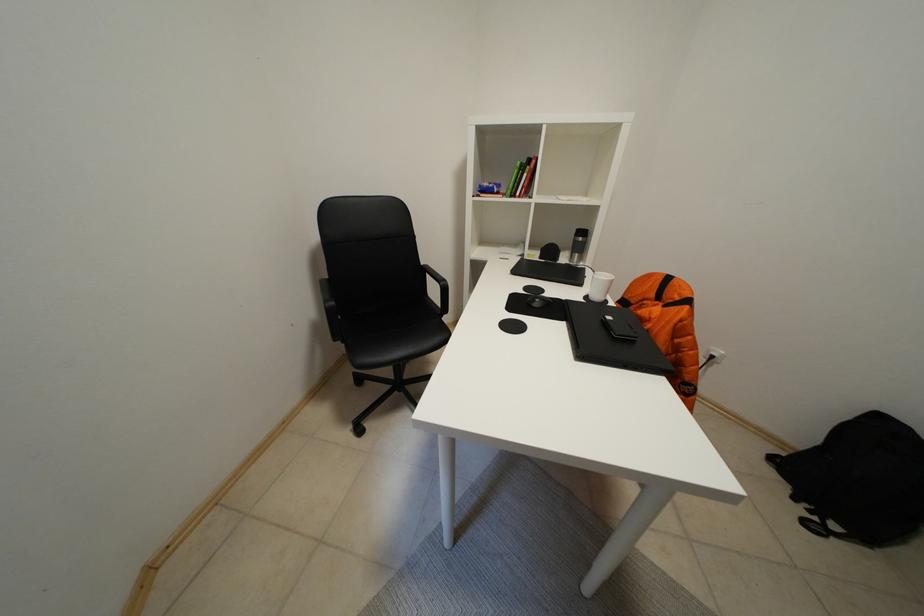
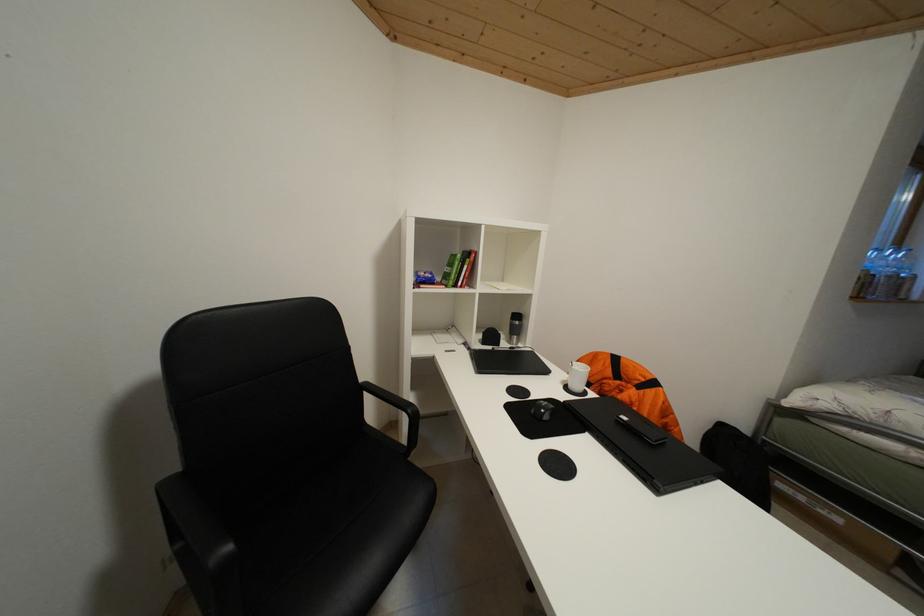
Question: How did the camera likely rotate?

Choices:
 (A) Left
 (B) Right
 (C) Up
 (D) Down

Answer: (B)